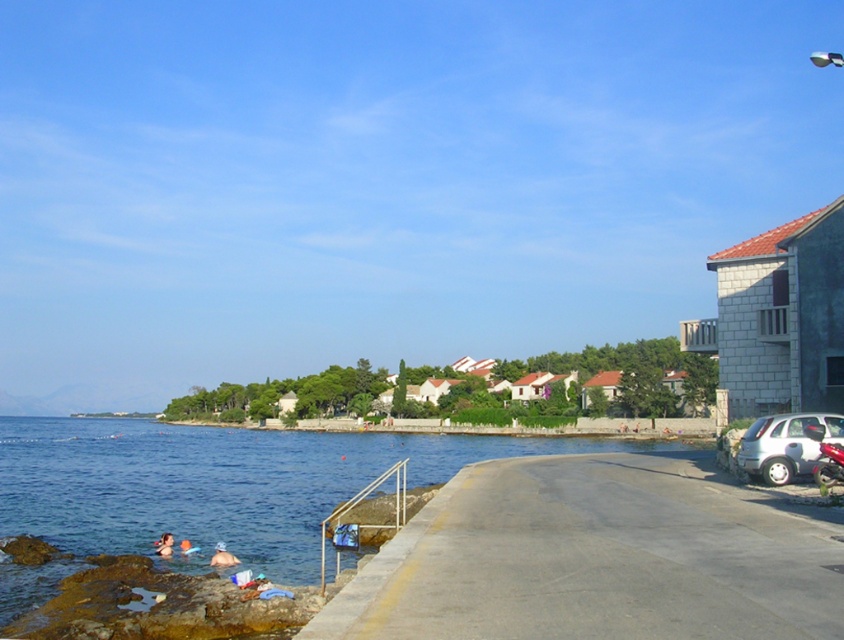
Question: Which object appears closest to the camera in this image?

Choices:
 (A) silver metallic hatchback at lower right
 (B) blue water at lower left
 (C) concrete at lower left

Answer: (C)

Question: Is blue water at lower left to the right of silver metallic hatchback at lower right from the viewer's perspective?

Choices:
 (A) no
 (B) yes

Answer: (A)

Question: Is blue water at lower left smaller than white fabric swimmer at lower left?

Choices:
 (A) no
 (B) yes

Answer: (A)

Question: Which object appears closest to the camera in this image?

Choices:
 (A) blue water at lower left
 (B) white fabric swimmer at lower left
 (C) silver metallic hatchback at lower right

Answer: (A)

Question: Which point appears farthest from the camera in this image?

Choices:
 (A) tap(740, 467)
 (B) tap(166, 474)

Answer: (B)

Question: Does blue water at lower left come in front of white fabric swimmer at lower left?

Choices:
 (A) no
 (B) yes

Answer: (B)